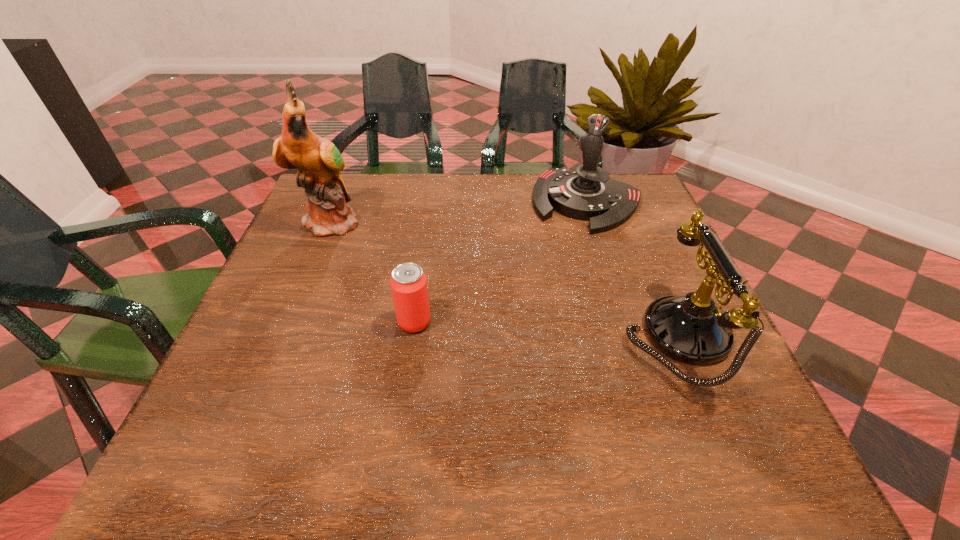
Find the location of a particular element. the second object from left to right is located at coordinates (408, 283).

Locate an element on the screen. This screenshot has height=540, width=960. beer can is located at coordinates (408, 283).

Find the location of a particular element. telephone is located at coordinates (693, 329).

Locate an element on the screen. the leftmost object is located at coordinates (319, 161).

What are the coordinates of `the tallest object` in the screenshot? It's located at (319, 161).

Find the location of a particular element. This screenshot has width=960, height=540. joystick is located at coordinates (588, 193).

Locate an element on the screen. The width and height of the screenshot is (960, 540). free point located 0.090m on the front of the beer can is located at coordinates (407, 374).

Where is `free spot located 0.180m on the front-facing side of the tallest object`? The height and width of the screenshot is (540, 960). free spot located 0.180m on the front-facing side of the tallest object is located at coordinates (402, 261).

At what (x,y) coordinates should I click in order to perform the action: click on vacant space located on the front-facing side of the tallest object. Please return your answer as a coordinate pair (x, y). Looking at the image, I should click on (442, 283).

This screenshot has height=540, width=960. Find the location of `vacant region located 0.300m on the front-facing side of the tallest object`. vacant region located 0.300m on the front-facing side of the tallest object is located at coordinates (442, 283).